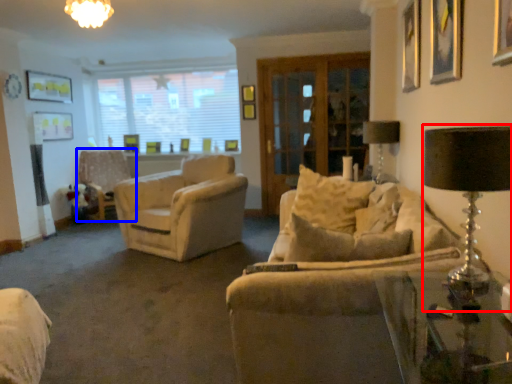
Question: Among these objects, which one is nearest to the camera, table lamp (highlighted by a red box) or chair (highlighted by a blue box)?

Choices:
 (A) table lamp
 (B) chair

Answer: (A)